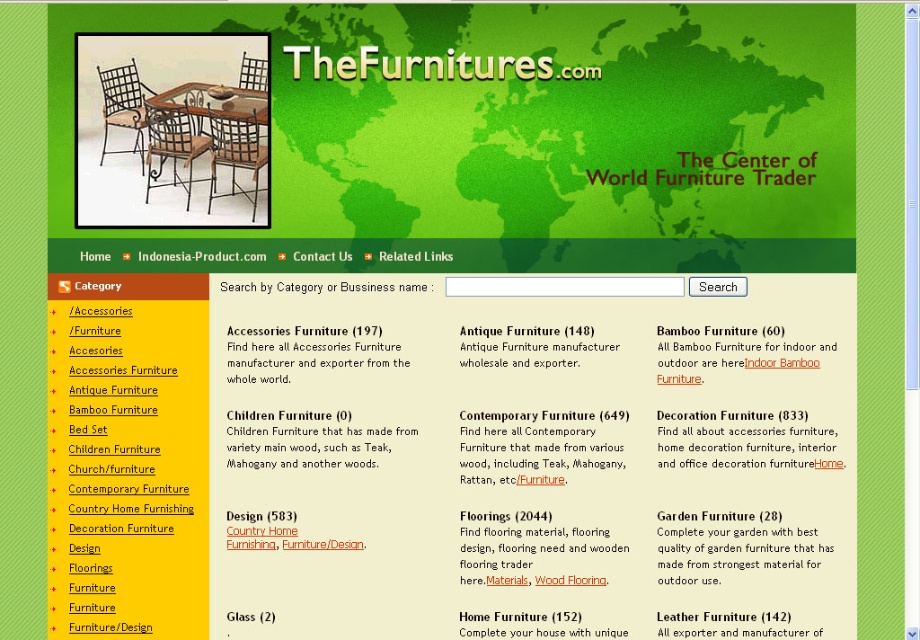
You are designing a layout for a new webpage and need to place the matte black chair at center and the black metal chair at center. According to the existing design, which chair should be placed lower on the page?

The matte black chair at center should be placed lower because it is positioned under the black metal chair at center in the existing design.